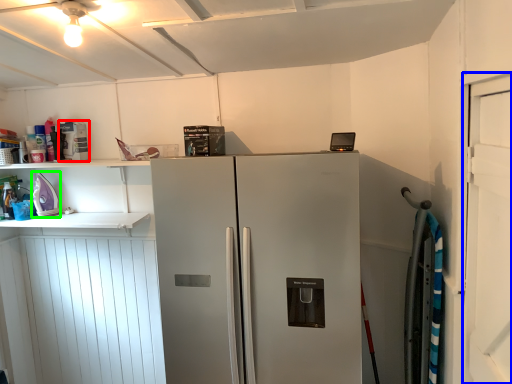
Question: Considering the real-world distances, which object is closest to appliance (highlighted by a red box)? door (highlighted by a blue box) or appliance (highlighted by a green box).

Choices:
 (A) door
 (B) appliance

Answer: (B)